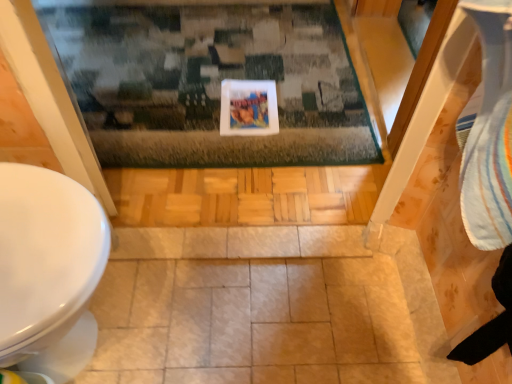
What are the coordinates of `textured green rug at center` in the screenshot? It's located at (210, 82).

The width and height of the screenshot is (512, 384). Describe the element at coordinates (210, 82) in the screenshot. I see `textured green rug at center` at that location.

Measure the distance between textured green rug at center and camera.

The depth of textured green rug at center is 4.57 feet.

Where is `textured green rug at center`? The image size is (512, 384). textured green rug at center is located at coordinates (210, 82).